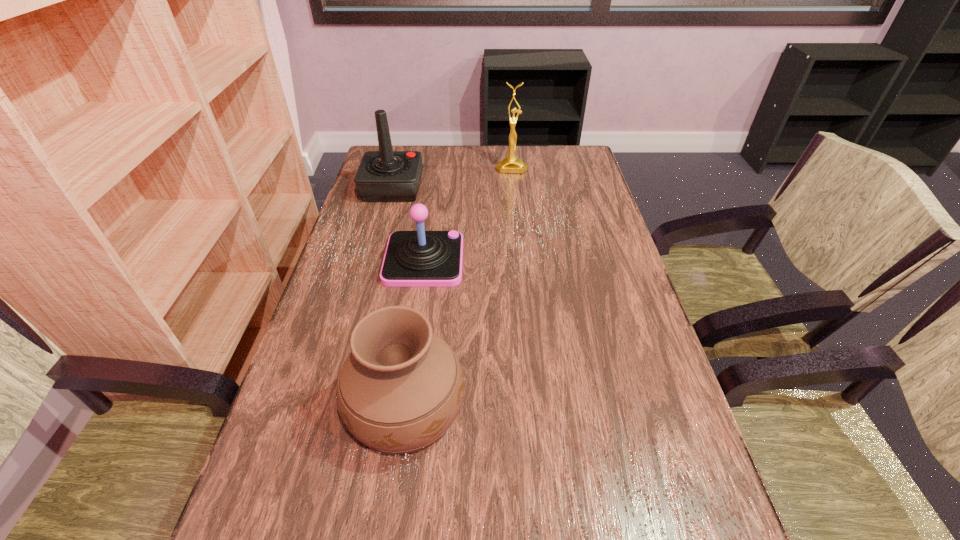
Where is `vacant area that lies between the shorter joystick and the rightmost object`? vacant area that lies between the shorter joystick and the rightmost object is located at coordinates (468, 214).

What are the coordinates of `vacant area between the taller joystick and the second nearest object` in the screenshot? It's located at (408, 224).

The width and height of the screenshot is (960, 540). Identify the location of vacant space that is in between the nearest object and the taller joystick. (399, 297).

In order to click on vacant area that lies between the farther joystick and the urn in this screenshot , I will do `click(399, 297)`.

Identify the location of vacant region between the award and the taller joystick. 452,178.

Locate an element on the screen. free space between the award and the second shortest object is located at coordinates (459, 287).

Where is `free space between the taller joystick and the urn`? Image resolution: width=960 pixels, height=540 pixels. free space between the taller joystick and the urn is located at coordinates (399, 297).

Locate an element on the screen. object that is the closest to the taller joystick is located at coordinates (420, 258).

Locate an element on the screen. Image resolution: width=960 pixels, height=540 pixels. object that is the nearest to the award is located at coordinates (383, 176).

I want to click on vacant area that satisfies the following two spatial constraints: 1. on the back side of the urn; 2. on the front-facing side of the farther joystick, so click(436, 188).